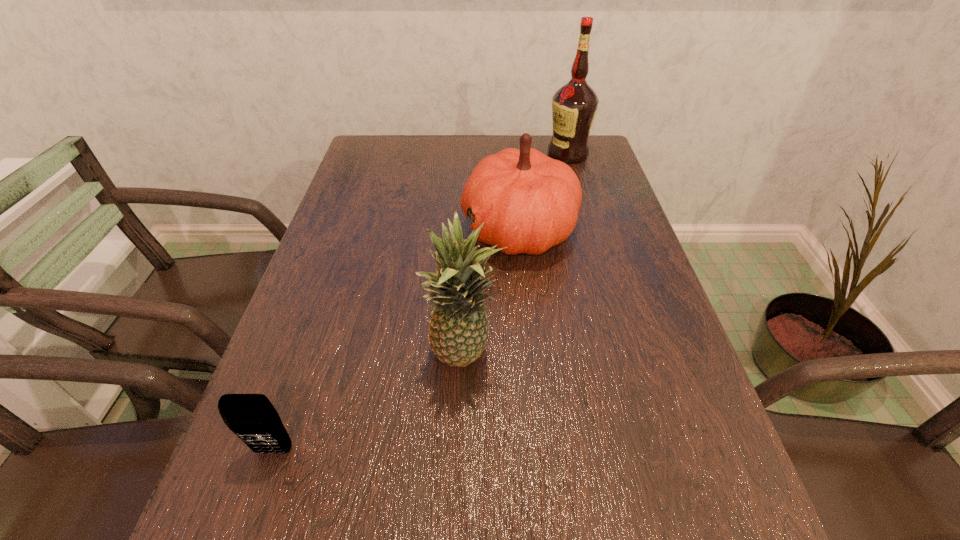
At what (x,y) coordinates should I click in order to perform the action: click on the farthest object. Please return your answer as a coordinate pair (x, y). Looking at the image, I should click on (574, 105).

Find the location of a particular element. The width and height of the screenshot is (960, 540). the tallest object is located at coordinates (574, 105).

At what (x,y) coordinates should I click in order to perform the action: click on the second tallest object. Please return your answer as a coordinate pair (x, y). The height and width of the screenshot is (540, 960). Looking at the image, I should click on (458, 329).

You are a GUI agent. You are given a task and a screenshot of the screen. Output one action in this format:
    pyautogui.click(x=<x>, y=<y>)
    Task: Click on the third farthest object
    
    Given the screenshot: What is the action you would take?
    pyautogui.click(x=458, y=329)

Locate an element on the screen. The image size is (960, 540). the third nearest object is located at coordinates (529, 202).

The width and height of the screenshot is (960, 540). In order to click on the second shortest object in this screenshot , I will do `click(529, 202)`.

The height and width of the screenshot is (540, 960). What are the coordinates of `the nearest object` in the screenshot? It's located at tap(252, 417).

I want to click on the shortest object, so click(x=252, y=417).

The height and width of the screenshot is (540, 960). In order to click on free region located on the label of the alcohol in this screenshot , I will do `click(499, 154)`.

The height and width of the screenshot is (540, 960). I want to click on vacant space located on the label of the alcohol, so click(492, 154).